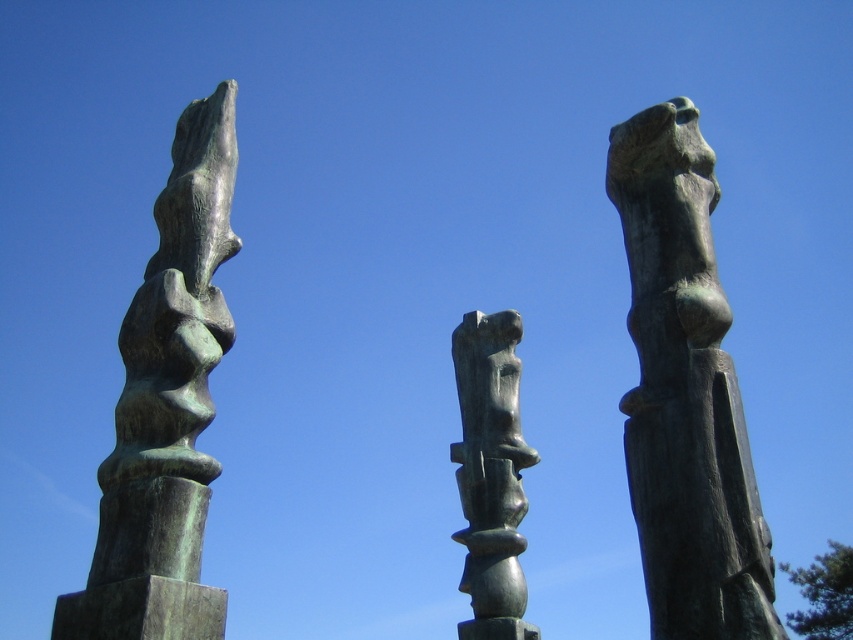
Does bronze statue at right have a greater height compared to green patinated stone figure at center?

In fact, bronze statue at right may be shorter than green patinated stone figure at center.

Can you confirm if bronze statue at right is positioned below green patinated stone figure at center?

Actually, bronze statue at right is above green patinated stone figure at center.

Is point (642, 173) positioned behind point (502, 589)?

No, (642, 173) is closer to viewer.

This screenshot has height=640, width=853. Find the location of `bronze statue at right`. bronze statue at right is located at coordinates (685, 392).

Does green patina sculpture at left appear on the right side of green patinated stone figure at center?

Incorrect, green patina sculpture at left is not on the right side of green patinated stone figure at center.

This screenshot has height=640, width=853. In order to click on green patina sculpture at left in this screenshot , I will do `click(166, 406)`.

Is the position of bronze statue at right more distant than that of green patina sculpture at left?

That is False.

Does bronze statue at right appear on the left side of green patina sculpture at left?

Incorrect, bronze statue at right is not on the left side of green patina sculpture at left.

Between point (683, 328) and point (183, 504), which one is positioned behind?

The point (183, 504) is more distant.

Where is `bronze statue at right`? bronze statue at right is located at coordinates (685, 392).